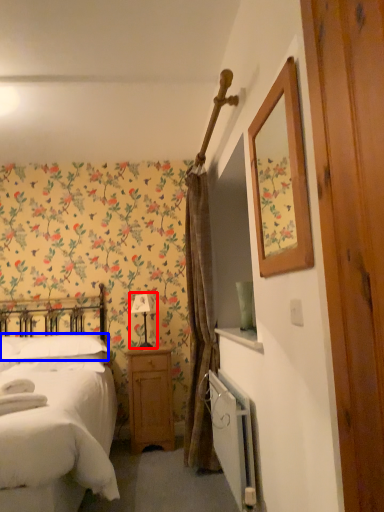
Question: Which object appears closest to the camera in this image, table lamp (highlighted by a red box) or pillow (highlighted by a blue box)?

Choices:
 (A) table lamp
 (B) pillow

Answer: (B)